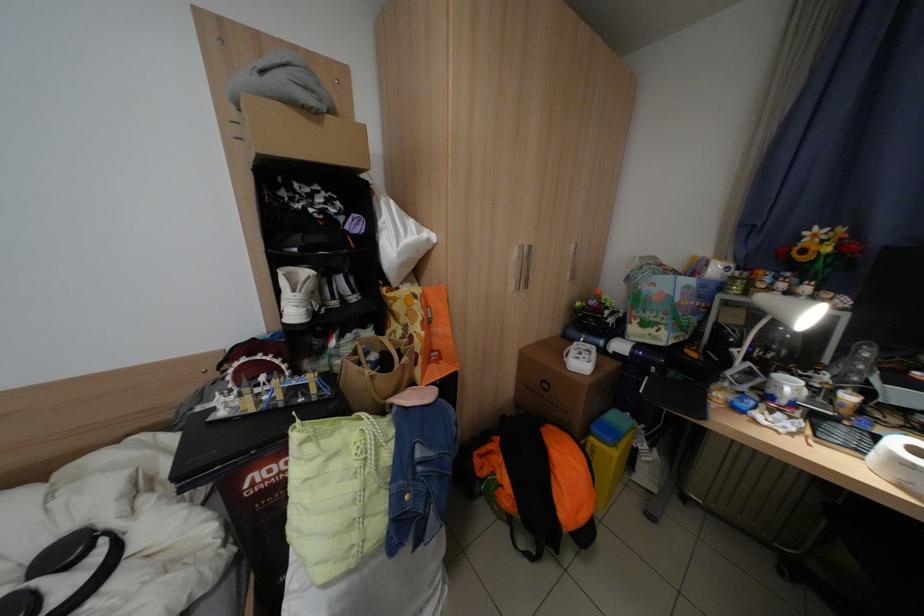
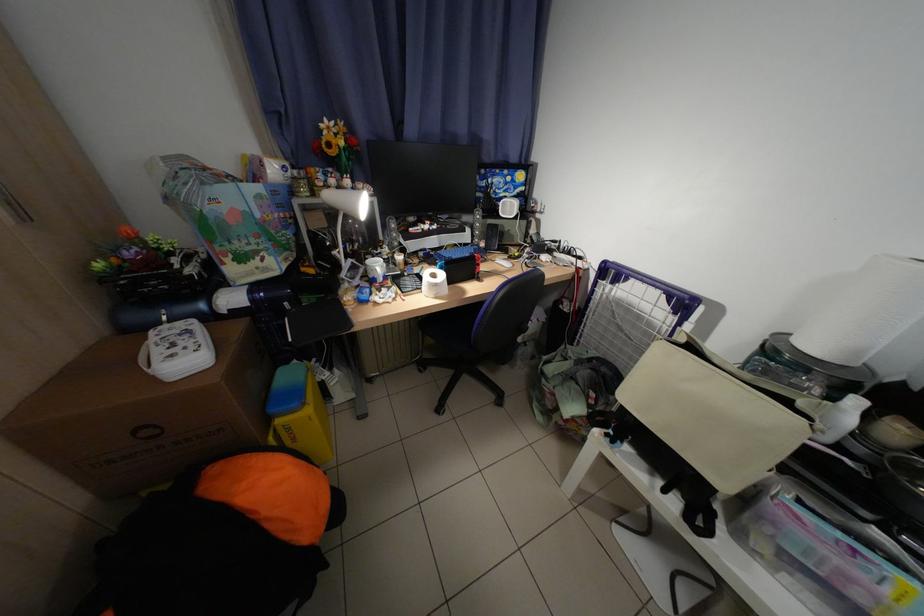
First-person continuous shooting, in which direction is the camera rotating?

The rotation direction of the camera is right-down.